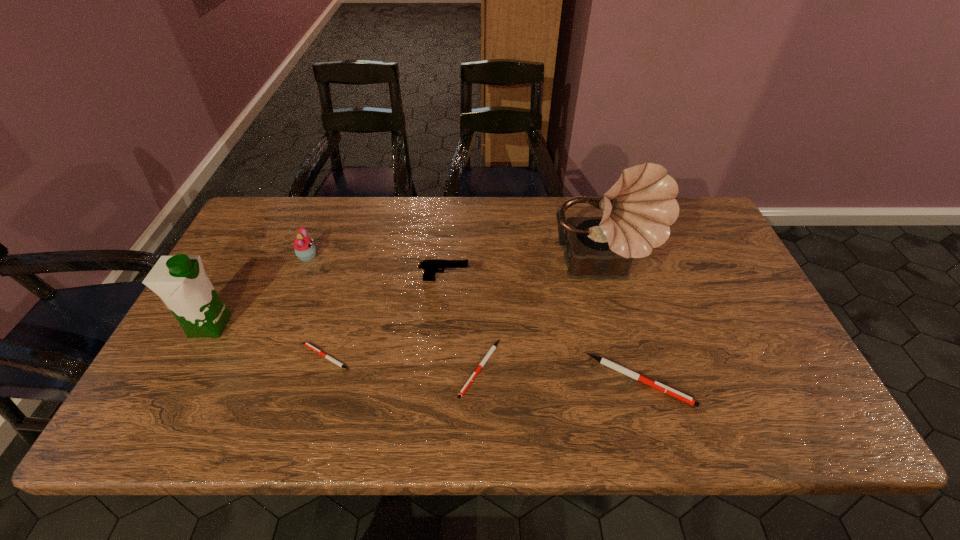
Please point out where to position a new pen on the right to maintain spacing. Please provide its 2D coordinates. Your answer should be formatted as a tuple, i.e. [(x, y)], where the tuple contains the x and y coordinates of a point satisfying the conditions above.

[(806, 393)]